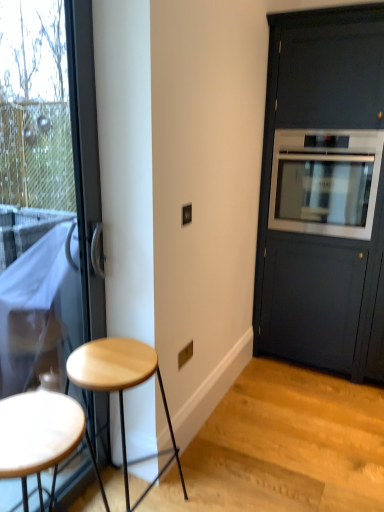
In order to click on free space above light wood stool at lower left, the first stool from the back (from a real-world perspective) in this screenshot , I will do `click(109, 365)`.